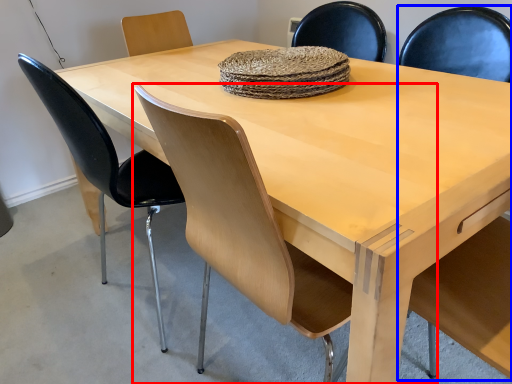
Question: Which point is closer to the camera, chair (highlighted by a red box) or armchair (highlighted by a blue box)?

Choices:
 (A) chair
 (B) armchair

Answer: (B)